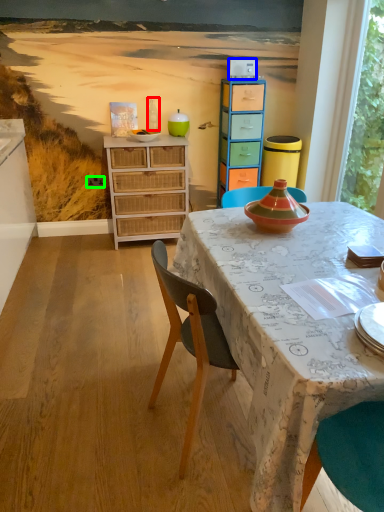
Question: Which object is the farthest from bottle (highlighted by a red box)? Choose among these: corded phone (highlighted by a blue box) or power outlet (highlighted by a green box).

Choices:
 (A) corded phone
 (B) power outlet

Answer: (A)